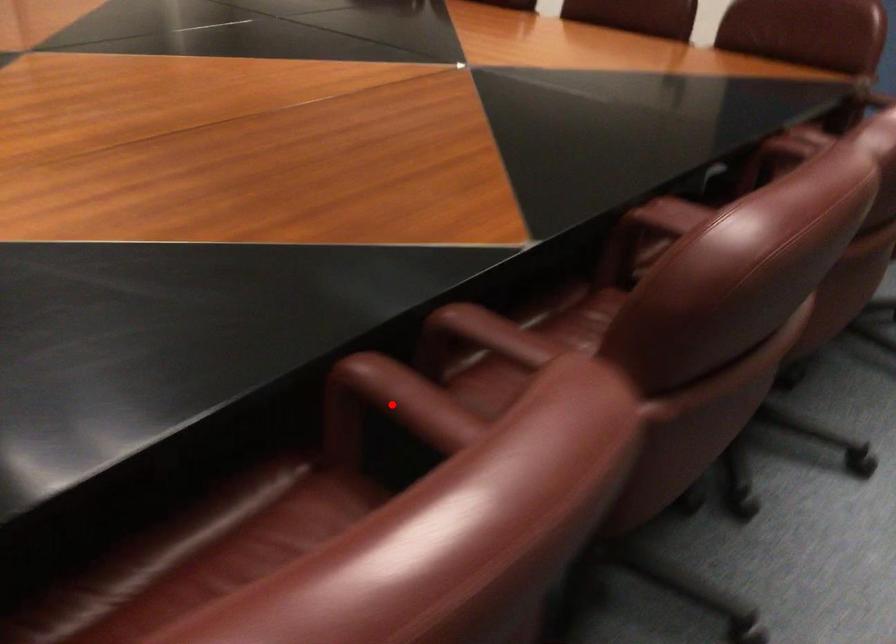
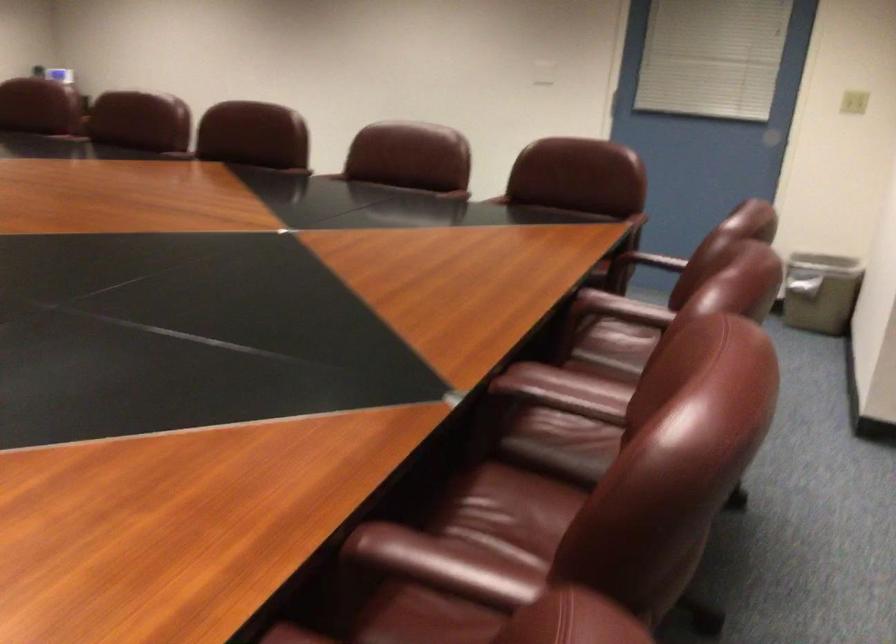
Question: I am providing you with two images of the same scene from different viewpoints. A red point is marked on the first image. At the location where the point appears in image 1, is it still visible in image 2?

Choices:
 (A) Yes
 (B) No

Answer: (B)